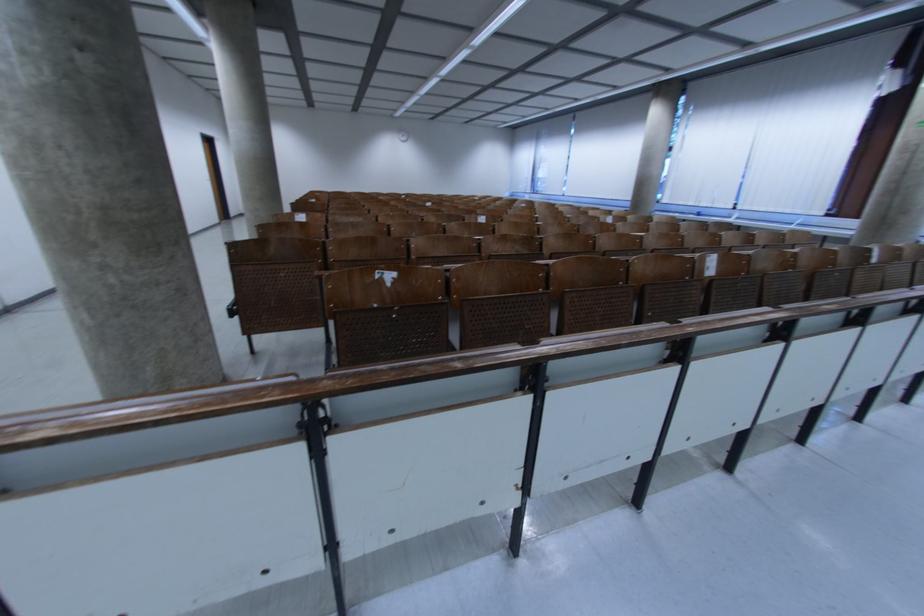
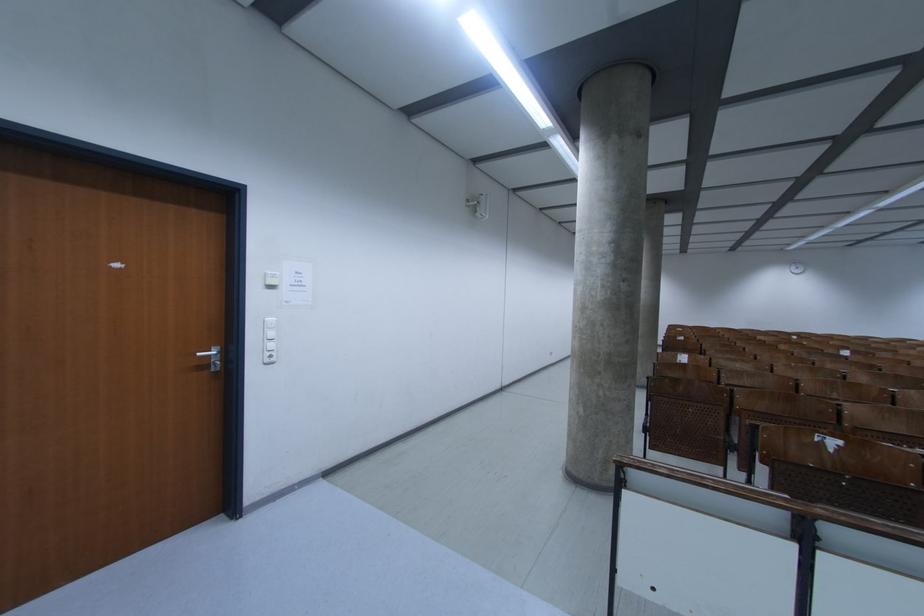
Question: The camera is either moving clockwise (left) or counter-clockwise (right) around the object. The first image is from the beginning of the video and the second image is from the end. Is the camera moving left or right when shooting the video?

Choices:
 (A) Left
 (B) Right

Answer: (B)